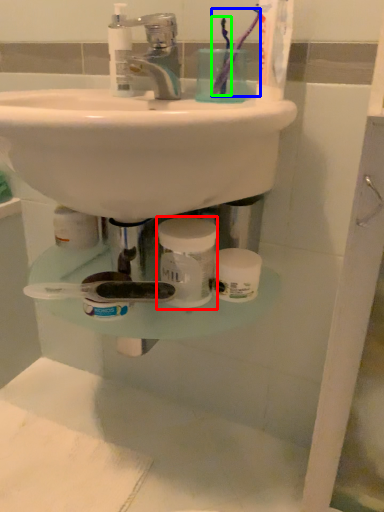
Question: Considering the real-world distances, which object is farthest from mouthwash (highlighted by a red box)? toothbrush (highlighted by a blue box) or toothbrush (highlighted by a green box)?

Choices:
 (A) toothbrush
 (B) toothbrush

Answer: (A)